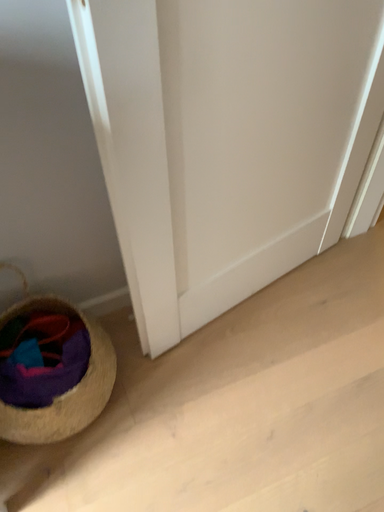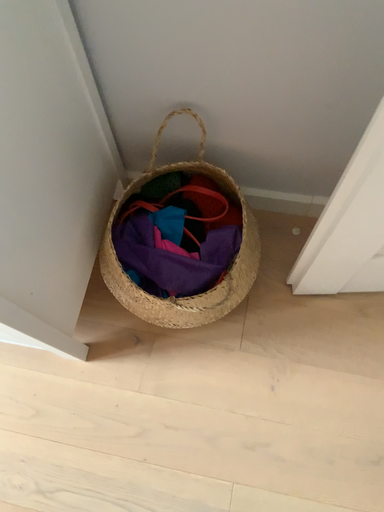
Question: Which way did the camera rotate in the video?

Choices:
 (A) rotated right
 (B) rotated left

Answer: (B)